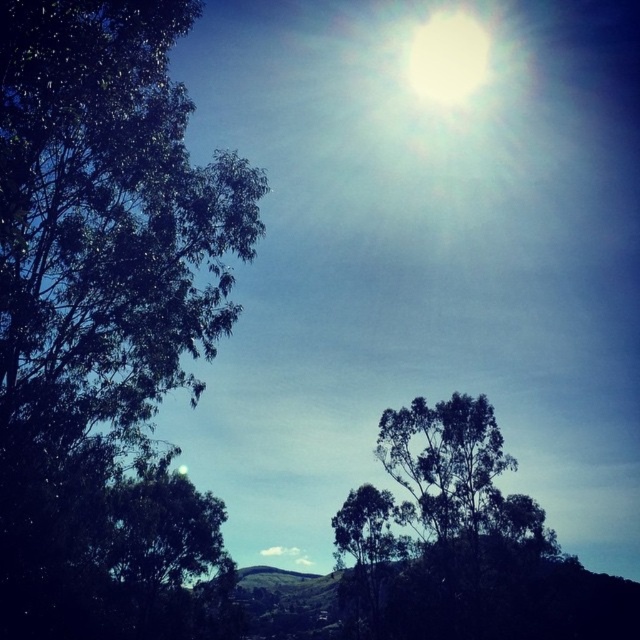
You are a bird flying in the sky and want to land on the highest object between the green leafy tree at left and the white glossy sun at upper center. Which object should you choose?

The green leafy tree at left has a greater height compared to the white glossy sun at upper center, so you should choose the green leafy tree at left to land on.

You are standing in the middle of a field and see the green leafy tree at left and the green leafy tree at center. Which tree has a wider trunk?

The green leafy tree at center has a wider trunk than the green leafy tree at left.

You are standing in the outdoor scene and want to walk from your current position to the point at coordinates point (x=404, y=68). There is an obstacle at point (x=3, y=220). Will you encounter the obstacle before reaching your destination?

Yes, you will encounter the obstacle at point (x=3, y=220) before reaching point (x=404, y=68) because point (x=3, y=220) is in front of point (x=404, y=68).